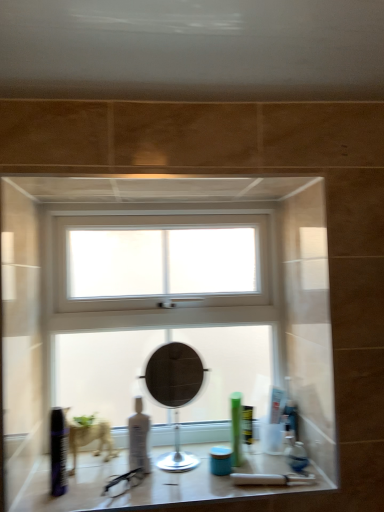
This screenshot has width=384, height=512. What are the coordinates of `vacant area on top of clear glass window at center (from a real-world perspective)` in the screenshot? It's located at (168, 200).